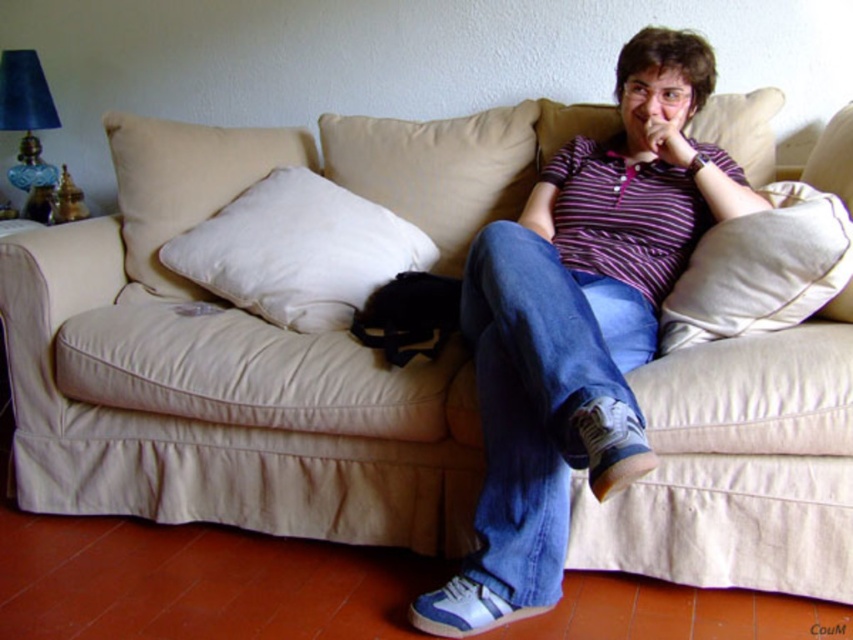
Question: Which object is the closest to the white soft pillow at center?

Choices:
 (A) purple striped shirt at center
 (B) beige fabric pillow at right
 (C) white fabric pillow at center
 (D) blue denim jeans at center

Answer: (A)

Question: Where is beige fabric pillow at right located in relation to matte purple shirt at upper center in the image?

Choices:
 (A) right
 (B) left

Answer: (A)

Question: Which of the following is the farthest from the observer?

Choices:
 (A) (703, 134)
 (B) (680, 120)

Answer: (A)

Question: Can you confirm if purple striped shirt at center is bigger than blue denim jeans at center?

Choices:
 (A) no
 (B) yes

Answer: (B)

Question: Can you confirm if blue denim jeans at center is bigger than white soft pillow at center?

Choices:
 (A) yes
 (B) no

Answer: (A)

Question: Estimate the real-world distances between objects in this image. Which object is closer to the purple striped shirt at center?

Choices:
 (A) beige fabric pillow at center
 (B) matte purple shirt at upper center
 (C) white soft cushion at center
 (D) white fabric pillow at center

Answer: (B)